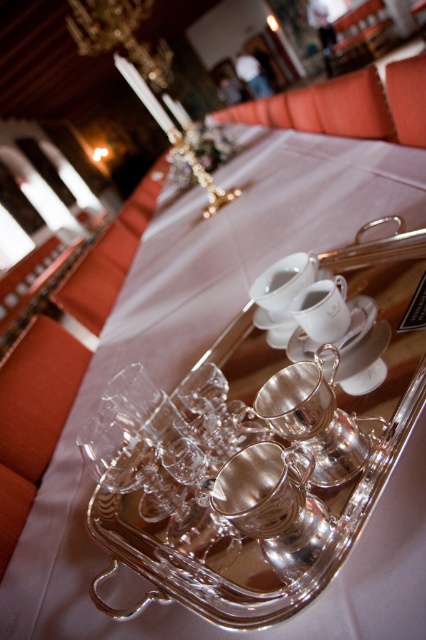
You are a server at a formal dinner and need to reach for the white porcelain saucer at center without disturbing the clear glass cups at center. Is this possible given their arrangement?

The clear glass cups at center are in front of the white porcelain saucer at center, so you can carefully move the clear glass cups out of the way to access the saucer.

You are a server at a formal event and need to determine which item is more suitable for serving a hot beverage. Based on the scene, which item between the clear glass cups at center and the white porcelain saucer at center would be better suited for this purpose?

The white porcelain saucer at center is better suited for serving hot beverages because it can hold a teacup, which is typically used for tea, and porcelain retains heat better than glass.

You are a server preparing to place a dessert on the white porcelain saucer at center. The dessert requires a garnish that must be placed precisely 10 inches away from the saucer. Given the clear glass cups at center are already on the tray, can you place the garnish on the saucer without moving the cups?

The distance between the clear glass cups at center and the white porcelain saucer at center is 8.35 inches. Since the required garnish placement is 10 inches away, the current spacing is insufficient. Therefore, you cannot place the garnish on the saucer without moving the cups.